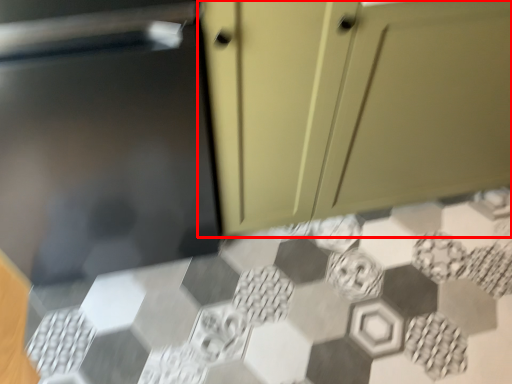
Question: From the image, what is the correct spatial relationship of cabinetry (annotated by the red box) in relation to ceramic tile?

Choices:
 (A) right
 (B) left

Answer: (A)